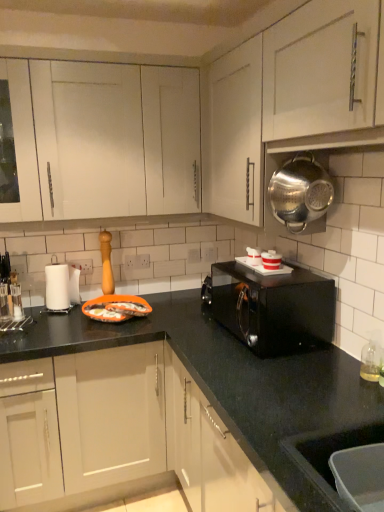
This screenshot has width=384, height=512. Identify the location of empty space that is ontop of black matte microwave oven at center. (272, 275).